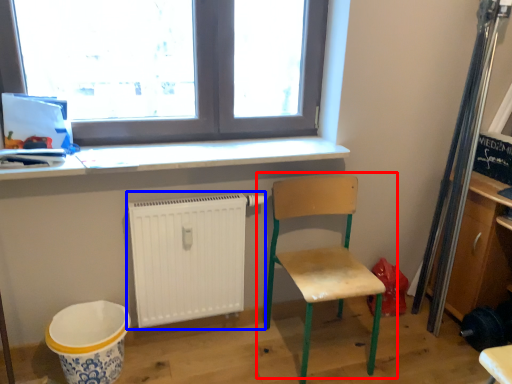
Question: Which point is further to the camera, chair (highlighted by a red box) or radiator (highlighted by a blue box)?

Choices:
 (A) chair
 (B) radiator

Answer: (B)